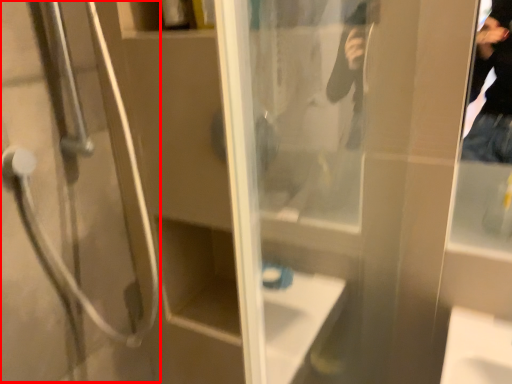
Question: From the image's perspective, where is shower door (annotated by the red box) located relative to screen door?

Choices:
 (A) below
 (B) above

Answer: (B)